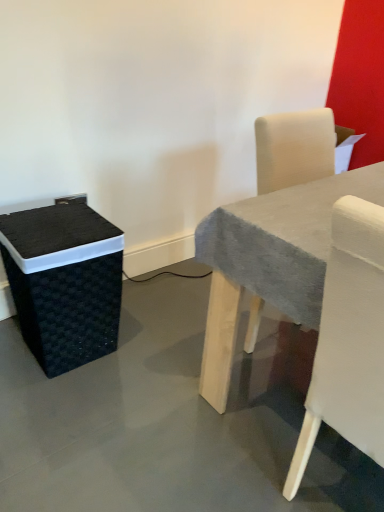
In order to face smooth gray table at center, should I rotate leftwards or rightwards?

Rotate your view right by about 16.925°.

Where is `black woven basket at left`? The width and height of the screenshot is (384, 512). black woven basket at left is located at coordinates (64, 282).

Where is `smooth gray table at center`? smooth gray table at center is located at coordinates (270, 261).

Considering the points (343, 288) and (316, 273), which point is in front, point (343, 288) or point (316, 273)?

The point (343, 288) is in front.

Who is taller, white fabric chair at right or smooth gray table at center?

white fabric chair at right is taller.

Considering the sizes of objects white fabric chair at right and smooth gray table at center in the image provided, who is thinner, white fabric chair at right or smooth gray table at center?

With smaller width is smooth gray table at center.

Is black woven basket at left thinner than smooth gray table at center?

Yes.

Visually, is black woven basket at left positioned to the left or to the right of smooth gray table at center?

Clearly, black woven basket at left is on the left of smooth gray table at center in the image.

From the picture: From the image's perspective, which is below, black woven basket at left or smooth gray table at center?

black woven basket at left is shown below in the image.

Can you confirm if smooth gray table at center is shorter than black woven basket at left?

No, smooth gray table at center is not shorter than black woven basket at left.

Does point (337, 192) come closer to viewer compared to point (77, 294)?

That is True.

Looking at this image, how distant is smooth gray table at center from black woven basket at left?

They are 21.93 inches apart.

Can you tell me how much smooth gray table at center and black woven basket at left differ in facing direction?

smooth gray table at center and black woven basket at left are facing 0.000756 degrees away from each other.

In the image, is smooth gray table at center positioned in front of or behind white fabric chair at right?

In the image, smooth gray table at center appears behind white fabric chair at right.

Can you see smooth gray table at center touching white fabric chair at right?

No, smooth gray table at center is not making contact with white fabric chair at right.

From a real-world perspective, is smooth gray table at center positioned above or below white fabric chair at right?

smooth gray table at center is situated lower than white fabric chair at right in the real world.

What are the coordinates of `chair below the smooth gray table at center (from the image's perspective)` in the screenshot? It's located at (348, 340).

Considering the sizes of objects white fabric chair at right and black woven basket at left in the image provided, who is wider, white fabric chair at right or black woven basket at left?

white fabric chair at right.

In the scene shown: Is black woven basket at left surrounded by white fabric chair at right?

Definitely not — black woven basket at left is not inside white fabric chair at right.

From the image's perspective, is white fabric chair at right beneath black woven basket at left?

Correct, white fabric chair at right appears lower than black woven basket at left in the image.

Could you tell me if white fabric chair at right is turned towards black woven basket at left?

No, white fabric chair at right is not oriented towards black woven basket at left.

Consider the image. Is black woven basket at left positioned beyond the bounds of white fabric chair at right?

Indeed, black woven basket at left is completely outside white fabric chair at right.

Which object is closer to the camera taking this photo, black woven basket at left or white fabric chair at right?

white fabric chair at right is closer to the camera.

In the scene shown: From a real-world perspective, is black woven basket at left beneath white fabric chair at right?

Yes, from a real-world perspective, black woven basket at left is beneath white fabric chair at right.

Which is in front, point (98, 304) or point (349, 269)?

The point (349, 269) is closer.

Image resolution: width=384 pixels, height=512 pixels. I want to click on chair in front of the smooth gray table at center, so click(348, 340).

At what (x,y) coordinates should I click in order to perform the action: click on table that is above the black woven basket at left (from a real-world perspective). Please return your answer as a coordinate pair (x, y). The width and height of the screenshot is (384, 512). Looking at the image, I should click on (270, 261).

From the image, which object appears to be nearer to black woven basket at left, white fabric chair at right or smooth gray table at center?

Among the two, smooth gray table at center is located nearer to black woven basket at left.

Which object lies nearer to the anchor point white fabric chair at right, smooth gray table at center or black woven basket at left?

The object closer to white fabric chair at right is smooth gray table at center.

When comparing their distances from smooth gray table at center, does black woven basket at left or white fabric chair at right seem further?

black woven basket at left lies further to smooth gray table at center than the other object.

When comparing their distances from black woven basket at left, does smooth gray table at center or white fabric chair at right seem further?

white fabric chair at right is positioned further to the anchor black woven basket at left.

Estimate the real-world distances between objects in this image. Which object is closer to white fabric chair at right, black woven basket at left or smooth gray table at center?

smooth gray table at center lies closer to white fabric chair at right than the other object.

In the scene shown: When comparing their distances from smooth gray table at center, does white fabric chair at right or black woven basket at left seem closer?

The object closer to smooth gray table at center is white fabric chair at right.

The width and height of the screenshot is (384, 512). I want to click on table located between black woven basket at left and white fabric chair at right in the left-right direction, so click(x=270, y=261).